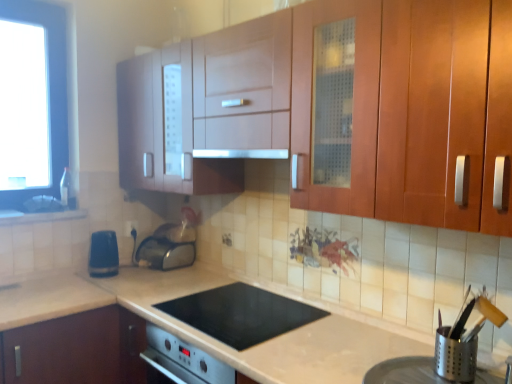
Question: Is black glass cooktop at center spatially inside blue plastic kettle at lower left, the first appliance from the left, or outside of it?

Choices:
 (A) inside
 (B) outside

Answer: (B)

Question: In the image, is black glass cooktop at center on the left side or the right side of blue plastic kettle at lower left, which appears as the 3th appliance when viewed from the front?

Choices:
 (A) right
 (B) left

Answer: (A)

Question: Based on their relative distances, which object is farther from the white glossy sink at lower left?

Choices:
 (A) satin silver toaster at lower center, positioned as the fourth appliance in front-to-back order
 (B) matte wood cabinet at upper center
 (C) blue plastic electric outlet at lower left
 (D) black glass cooktop at center
 (E) satin silver exhaust hood at center

Answer: (B)

Question: Considering the real-world distances, which object is closest to the matte wood cabinet at upper center?

Choices:
 (A) black glass cooktop at center
 (B) silver metallic utensil holder at lower right, the first appliance positioned from the front
 (C) satin silver toaster at lower center, the 2th appliance when ordered from left to right
 (D) white glossy sink at lower left
 (E) satin silver exhaust hood at center

Answer: (E)